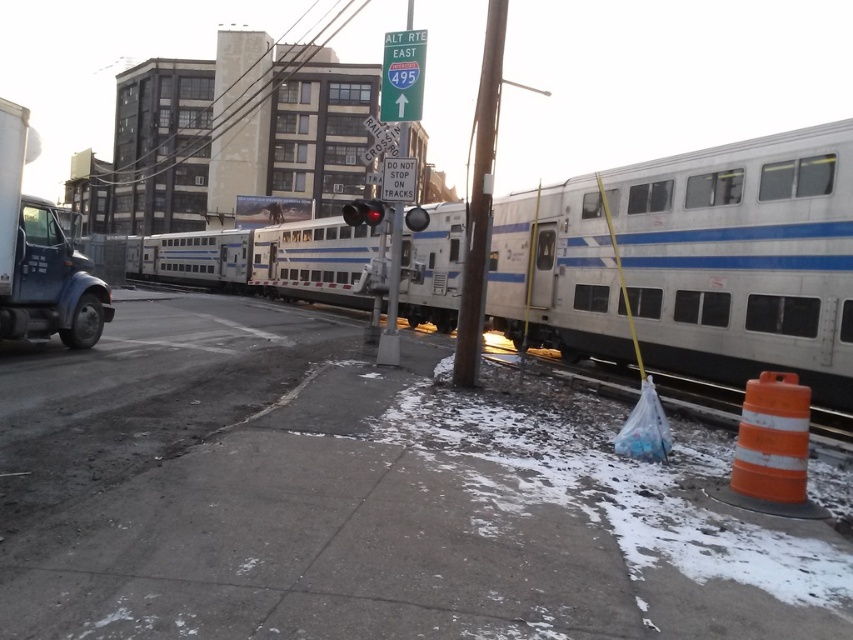
Question: Which object is the farthest from the silver metallic train at center?

Choices:
 (A) smooth wooden pole at center
 (B) orange reflective cone at lower right

Answer: (B)

Question: Which object is positioned farthest from the smooth wooden pole at center?

Choices:
 (A) orange reflective cone at lower right
 (B) silver metallic train at center

Answer: (B)

Question: Can you confirm if silver metallic train at center is positioned to the left of orange reflective cone at lower right?

Choices:
 (A) yes
 (B) no

Answer: (A)

Question: Is silver metallic train at center above orange reflective cone at lower right?

Choices:
 (A) no
 (B) yes

Answer: (B)

Question: Among these points, which one is nearest to the camera?

Choices:
 (A) (775, 472)
 (B) (844, 392)
 (C) (485, 262)

Answer: (A)

Question: Where is orange reflective cone at lower right located in relation to smooth wooden pole at center in the image?

Choices:
 (A) right
 (B) left

Answer: (A)